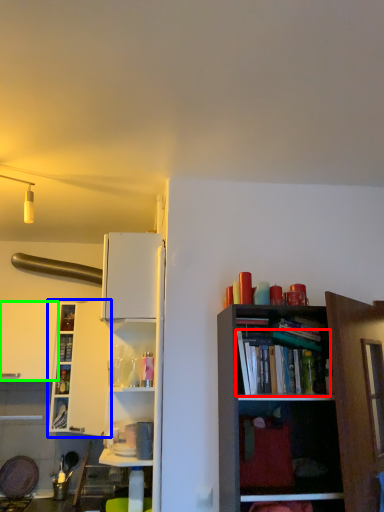
Question: Which object is positioned farthest from book (highlighted by a red box)? Select from shelf (highlighted by a blue box) and cabinetry (highlighted by a green box).

Choices:
 (A) shelf
 (B) cabinetry

Answer: (B)